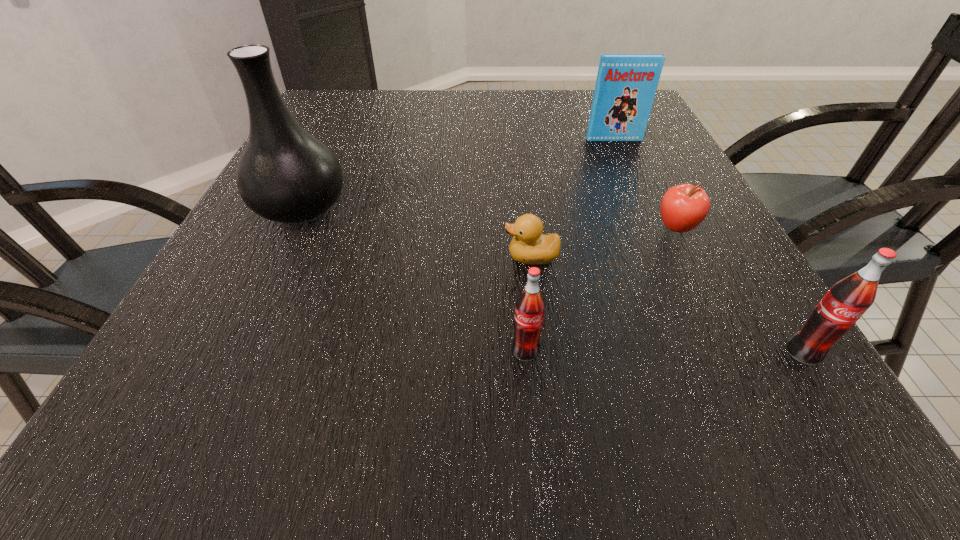
Image resolution: width=960 pixels, height=540 pixels. In order to click on free space located on the front cover of the book in this screenshot , I will do `click(651, 223)`.

You are a GUI agent. You are given a task and a screenshot of the screen. Output one action in this format:
    pyautogui.click(x=<x>, y=<y>)
    Task: Click on the vacant space located 0.340m facing forward on the duckling
    
    Given the screenshot: What is the action you would take?
    pyautogui.click(x=311, y=257)

Where is `vacant area situated 0.100m facing forward on the duckling`? The image size is (960, 540). vacant area situated 0.100m facing forward on the duckling is located at coordinates (447, 257).

Locate an element on the screen. This screenshot has width=960, height=540. free space located facing forward on the duckling is located at coordinates (469, 257).

I want to click on blank space located on the left of the apple, so click(x=602, y=228).

Find the location of `object situated at the left edge`. object situated at the left edge is located at coordinates (285, 174).

Find the location of `soda bottle located in the right edge section of the desktop`. soda bottle located in the right edge section of the desktop is located at coordinates (846, 301).

You are a GUI agent. You are given a task and a screenshot of the screen. Output one action in this format:
    pyautogui.click(x=<x>, y=<y>)
    Task: Click on the book that is positioned at the right edge
    The width and height of the screenshot is (960, 540).
    Given the screenshot: What is the action you would take?
    pyautogui.click(x=626, y=84)

Locate an element on the screen. The height and width of the screenshot is (540, 960). apple located in the right edge section of the desktop is located at coordinates (683, 207).

At what (x,y) coordinates should I click in order to perform the action: click on object that is at the near right corner. Please return your answer as a coordinate pair (x, y). Looking at the image, I should click on (846, 301).